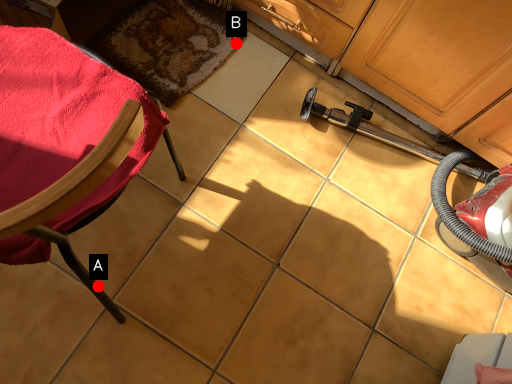
Question: Two points are circled on the image, labeled by A and B beside each circle. Which of the following is the closest to the observer?

Choices:
 (A) A is closer
 (B) B is closer

Answer: (A)